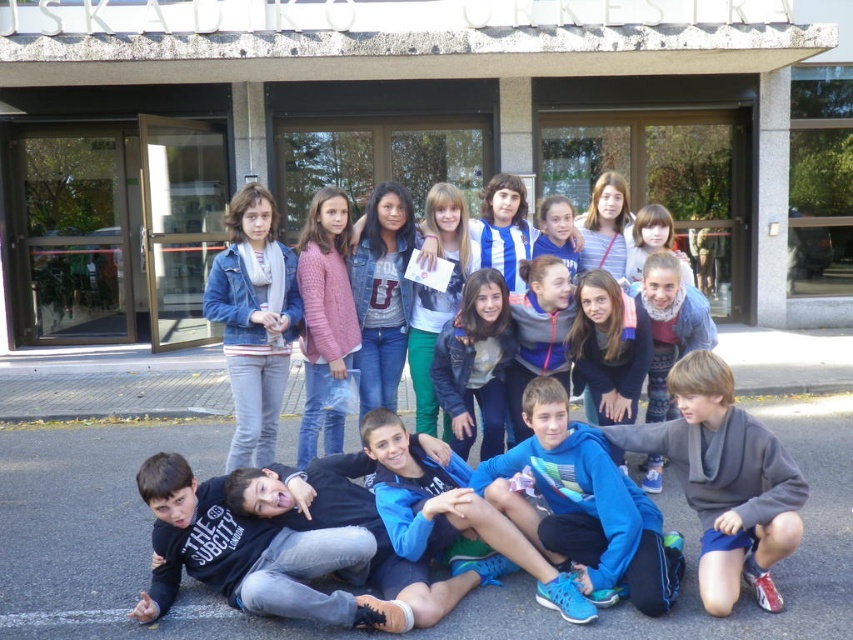
You are taking a photo of the children and notice two points in the image. The first point is at coordinate point (708, 556) and the second is at point (234, 349). Which point is closer to the camera?

Point (708, 556) is closer to the camera than point (234, 349).